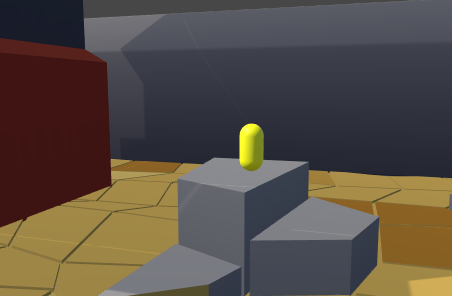
I want to click on wall, so click(x=305, y=88).